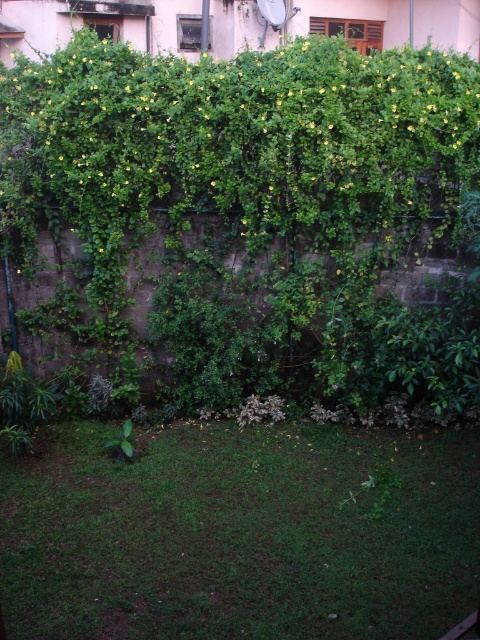
You are a gardener who wants to mow the green grass at lower center. However, there is a green leafy plant at center in the way. Which one should you mow first to avoid damaging the plant?

You should mow the green grass at lower center first because it is much taller than the green leafy plant at center, so mowing it first will prevent the mower from hitting the shorter plant.

You are planning to place a small garden statue that requires a 1 meter wide space. You see the green grass at lower center and the green leafy plant at center. Which area would be suitable for placing the statue?

The green grass at lower center might be wider than the green leafy plant at center, so the green grass at lower center is more likely to provide the required 1 meter width for placing the statue.

You are standing in the garden looking at the wall with climbing plants. There are two points marked on the wall at coordinates point (435, 129) and point (300, 492). Which point is closer to you?

Point (300, 492) is closer to you because it is less further to the camera than point (435, 129).